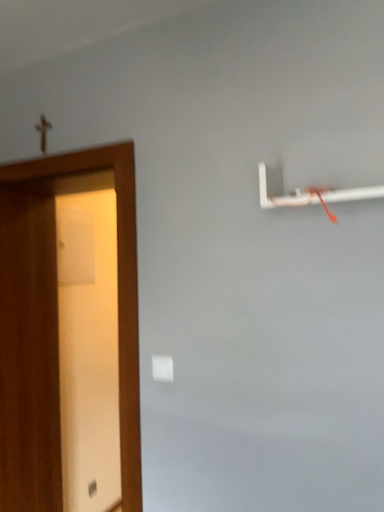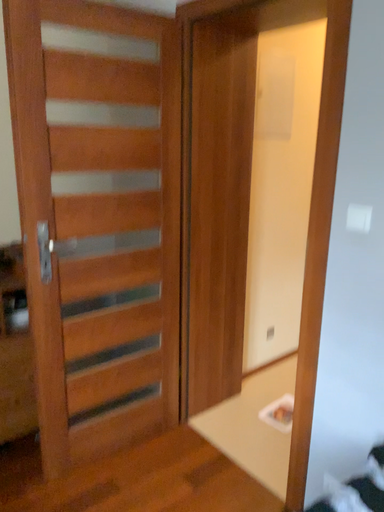
Question: Which way did the camera rotate in the video?

Choices:
 (A) rotated upward
 (B) rotated downward

Answer: (B)